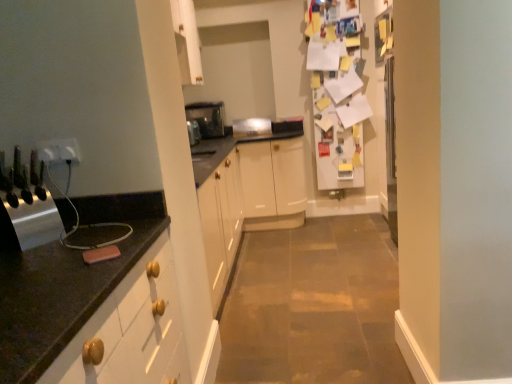
The width and height of the screenshot is (512, 384). What do you see at coordinates (337, 94) in the screenshot?
I see `white paper covered fridge at upper right` at bounding box center [337, 94].

Describe the element at coordinates (207, 118) in the screenshot. This screenshot has height=384, width=512. I see `satin silver toaster at center, which is counted as the fourth appliance, starting from the bottom` at that location.

You are a GUI agent. You are given a task and a screenshot of the screen. Output one action in this format:
    pyautogui.click(x=<x>, y=<y>)
    Task: Click on the satin silver toaster at center, which appears as the 3th appliance when viewed from the top
    This screenshot has height=384, width=512.
    Given the screenshot: What is the action you would take?
    pyautogui.click(x=193, y=132)

Measure the distance between point (40, 158) and camera.

A distance of 1.48 meters exists between point (40, 158) and camera.

What are the coordinates of `metallic knife block at left, marked as the 4th appliance in a back-to-front arrangement` in the screenshot? It's located at (28, 202).

Where is `white plastic outlet at left, which is the first electric outlet in right-to-left order`? Image resolution: width=512 pixels, height=384 pixels. white plastic outlet at left, which is the first electric outlet in right-to-left order is located at coordinates (59, 150).

Is white plastic electric outlet at left, which is counted as the 2th electric outlet, starting from the right, inside or outside of satin silver toaster at center, which appears as the first appliance when viewed from the back?

white plastic electric outlet at left, which is counted as the 2th electric outlet, starting from the right, is located beyond the bounds of satin silver toaster at center, which appears as the first appliance when viewed from the back.

Which object is positioned more to the left, white plastic electric outlet at left, which is the 1th electric outlet in left-to-right order, or satin silver toaster at center, marked as the 1th appliance in a top-to-bottom arrangement?

white plastic electric outlet at left, which is the 1th electric outlet in left-to-right order, is more to the left.

Is white plastic electric outlet at left, which is counted as the 2th electric outlet, starting from the right, thinner than satin silver toaster at center, which appears as the first appliance when viewed from the back?

Yes, white plastic electric outlet at left, which is counted as the 2th electric outlet, starting from the right, is thinner than satin silver toaster at center, which appears as the first appliance when viewed from the back.

Are white plastic electric outlet at left, which is counted as the 2th electric outlet, starting from the right, and satin silver toaster at center, which is counted as the fourth appliance, starting from the bottom, making contact?

There is a gap between white plastic electric outlet at left, which is counted as the 2th electric outlet, starting from the right, and satin silver toaster at center, which is counted as the fourth appliance, starting from the bottom.

Is satin silver toaster at center, acting as the second appliance starting from the top, thinner than white plastic outlet at left, which is the first electric outlet in right-to-left order?

In fact, satin silver toaster at center, acting as the second appliance starting from the top, might be wider than white plastic outlet at left, which is the first electric outlet in right-to-left order.

From the image's perspective, is satin silver toaster at center, acting as the third appliance starting from the front, above or below white plastic outlet at left, the second electric outlet from the left?

From the image's perspective, satin silver toaster at center, acting as the third appliance starting from the front, appears above white plastic outlet at left, the second electric outlet from the left.

Which is more distant, (x=244, y=130) or (x=70, y=149)?

The point (x=244, y=130) is farther.

Is satin silver toaster at center, which is the third appliance in bottom-to-top order, oriented away from white plastic outlet at left, which is the first electric outlet in right-to-left order?

satin silver toaster at center, which is the third appliance in bottom-to-top order, does not have its back to white plastic outlet at left, which is the first electric outlet in right-to-left order.

What's the angular difference between metallic knife block at left, marked as the 4th appliance in a back-to-front arrangement, and satin silver toaster at center, marked as the 1th appliance in a top-to-bottom arrangement,'s facing directions?

metallic knife block at left, marked as the 4th appliance in a back-to-front arrangement, and satin silver toaster at center, marked as the 1th appliance in a top-to-bottom arrangement, are facing 59.9 degrees away from each other.

Can you confirm if metallic knife block at left, marked as the 4th appliance in a back-to-front arrangement, is shorter than satin silver toaster at center, which is the 4th appliance from front to back?

Yes.

From the picture: From a real-world perspective, relative to satin silver toaster at center, which is counted as the fourth appliance, starting from the bottom, is metallic knife block at left, positioned as the 1th appliance in front-to-back order, vertically above or below?

metallic knife block at left, positioned as the 1th appliance in front-to-back order, is below satin silver toaster at center, which is counted as the fourth appliance, starting from the bottom.

Do you think metallic knife block at left, acting as the 4th appliance starting from the top, is within satin silver toaster at center, which appears as the first appliance when viewed from the back, or outside of it?

metallic knife block at left, acting as the 4th appliance starting from the top, is spatially situated outside satin silver toaster at center, which appears as the first appliance when viewed from the back.

Measure the distance between satin silver toaster at center, the third appliance from the back, and white paper covered fridge at upper right.

satin silver toaster at center, the third appliance from the back, is 4.68 feet from white paper covered fridge at upper right.

Is satin silver toaster at center, which appears as the 3th appliance when viewed from the top, in contact with white paper covered fridge at upper right?

No, satin silver toaster at center, which appears as the 3th appliance when viewed from the top, is not with white paper covered fridge at upper right.

Considering the positions of objects satin silver toaster at center, the second appliance in the bottom-to-top sequence, and white paper covered fridge at upper right in the image provided, who is more to the right, satin silver toaster at center, the second appliance in the bottom-to-top sequence, or white paper covered fridge at upper right?

white paper covered fridge at upper right is more to the right.

From a real-world perspective, relative to white paper covered fridge at upper right, is satin silver toaster at center, which appears as the 3th appliance when viewed from the top, vertically above or below?

Clearly, from a real-world perspective, satin silver toaster at center, which appears as the 3th appliance when viewed from the top, is below white paper covered fridge at upper right.

Are white plastic outlet at left, the second electric outlet from the left, and metallic knife block at left, acting as the 4th appliance starting from the top, beside each other?

No, white plastic outlet at left, the second electric outlet from the left, is not with metallic knife block at left, acting as the 4th appliance starting from the top.

Which object is more forward, white plastic outlet at left, which is the first electric outlet in right-to-left order, or metallic knife block at left, positioned as the 1th appliance in front-to-back order?

metallic knife block at left, positioned as the 1th appliance in front-to-back order, is more forward.

Is white plastic outlet at left, the second electric outlet from the left, facing towards metallic knife block at left, marked as the 4th appliance in a back-to-front arrangement?

Yes, white plastic outlet at left, the second electric outlet from the left, is facing metallic knife block at left, marked as the 4th appliance in a back-to-front arrangement.

Based on the photo, from the image's perspective, is white plastic outlet at left, which is the first electric outlet in right-to-left order, positioned above or below metallic knife block at left, positioned as the 1th appliance in front-to-back order?

From the image's perspective, white plastic outlet at left, which is the first electric outlet in right-to-left order, appears above metallic knife block at left, positioned as the 1th appliance in front-to-back order.

Considering the relative sizes of satin silver toaster at center, which is the third appliance in bottom-to-top order, and white paper covered fridge at upper right in the image provided, is satin silver toaster at center, which is the third appliance in bottom-to-top order, smaller than white paper covered fridge at upper right?

Indeed, satin silver toaster at center, which is the third appliance in bottom-to-top order, has a smaller size compared to white paper covered fridge at upper right.

In the scene shown: Is satin silver toaster at center, which is the third appliance in bottom-to-top order, located outside white paper covered fridge at upper right?

That's correct, satin silver toaster at center, which is the third appliance in bottom-to-top order, is outside of white paper covered fridge at upper right.

Between satin silver toaster at center, acting as the second appliance starting from the top, and white paper covered fridge at upper right, which one appears on the left side from the viewer's perspective?

satin silver toaster at center, acting as the second appliance starting from the top, is more to the left.

Is white plastic outlet at left, the second electric outlet from the left, at the back of satin silver toaster at center, which appears as the first appliance when viewed from the back?

No.

Is satin silver toaster at center, marked as the 1th appliance in a top-to-bottom arrangement, taller or shorter than white plastic outlet at left, which is the first electric outlet in right-to-left order?

Clearly, satin silver toaster at center, marked as the 1th appliance in a top-to-bottom arrangement, is taller compared to white plastic outlet at left, which is the first electric outlet in right-to-left order.

Is satin silver toaster at center, which appears as the first appliance when viewed from the back, not close to white plastic outlet at left, which is the first electric outlet in right-to-left order?

Absolutely, satin silver toaster at center, which appears as the first appliance when viewed from the back, is distant from white plastic outlet at left, which is the first electric outlet in right-to-left order.

You are a GUI agent. You are given a task and a screenshot of the screen. Output one action in this format:
    pyautogui.click(x=<x>, y=<y>)
    Task: Click on the 2nd appliance to the right of the white plastic outlet at left, which is the first electric outlet in right-to-left order, counting from the anchor's position
    The width and height of the screenshot is (512, 384).
    Given the screenshot: What is the action you would take?
    (x=207, y=118)

From the white plastic electric outlet at left, which is counted as the 2th electric outlet, starting from the right, count 3rd appliance to the right and point to it. Please provide its 2D coordinates.

[(207, 118)]

You are a GUI agent. You are given a task and a screenshot of the screen. Output one action in this format:
    pyautogui.click(x=<x>, y=<y>)
    Task: Click on the 4th appliance below the white plastic outlet at left, which is the first electric outlet in right-to-left order (from a real-world perspective)
    The width and height of the screenshot is (512, 384).
    Given the screenshot: What is the action you would take?
    pyautogui.click(x=251, y=127)

When comparing their distances from white plastic electric outlet at left, which is the 1th electric outlet in left-to-right order, does satin silver toaster at center, which appears as the first appliance when viewed from the back, or white paper covered fridge at upper right seem further?

The object further to white plastic electric outlet at left, which is the 1th electric outlet in left-to-right order, is white paper covered fridge at upper right.

Which object lies nearer to the anchor point metallic knife block at left, acting as the 4th appliance starting from the top, satin silver toaster at center, marked as the 1th appliance in a top-to-bottom arrangement, or white plastic outlet at left, which is the first electric outlet in right-to-left order?

white plastic outlet at left, which is the first electric outlet in right-to-left order.

From the image, which object appears to be farther from white plastic outlet at left, the second electric outlet from the left, satin silver toaster at center, the second appliance positioned from the back, or metallic knife block at left, marked as the 4th appliance in a back-to-front arrangement?

satin silver toaster at center, the second appliance positioned from the back, lies further to white plastic outlet at left, the second electric outlet from the left, than the other object.

Based on their spatial positions, is white paper covered fridge at upper right or white plastic outlet at left, which is the first electric outlet in right-to-left order, further from white plastic electric outlet at left, which is the 1th electric outlet in left-to-right order?

white paper covered fridge at upper right lies further to white plastic electric outlet at left, which is the 1th electric outlet in left-to-right order, than the other object.

Based on their spatial positions, is white paper covered fridge at upper right or white plastic outlet at left, the second electric outlet from the left, further from satin silver toaster at center, the second appliance positioned from the back?

white plastic outlet at left, the second electric outlet from the left, is positioned further to the anchor satin silver toaster at center, the second appliance positioned from the back.

Based on their spatial positions, is white plastic electric outlet at left, which is counted as the 2th electric outlet, starting from the right, or satin silver toaster at center, acting as the second appliance starting from the top, closer to white plastic outlet at left, the second electric outlet from the left?

white plastic electric outlet at left, which is counted as the 2th electric outlet, starting from the right, is positioned closer to the anchor white plastic outlet at left, the second electric outlet from the left.

Based on their spatial positions, is white paper covered fridge at upper right or white plastic outlet at left, which is the first electric outlet in right-to-left order, closer to satin silver toaster at center, which appears as the 3th appliance when viewed from the top?

Among the two, white paper covered fridge at upper right is located nearer to satin silver toaster at center, which appears as the 3th appliance when viewed from the top.

Based on their spatial positions, is satin silver toaster at center, the third appliance from the back, or satin silver toaster at center, which is the third appliance in bottom-to-top order, closer to white plastic electric outlet at left, which is counted as the 2th electric outlet, starting from the right?

satin silver toaster at center, the third appliance from the back, is positioned closer to the anchor white plastic electric outlet at left, which is counted as the 2th electric outlet, starting from the right.

What are the coordinates of `electric outlet between white plastic electric outlet at left, which is counted as the 2th electric outlet, starting from the right, and satin silver toaster at center, the third appliance from the back, in the front-back direction` in the screenshot? It's located at (59, 150).

In order to click on appliance between metallic knife block at left, marked as the 4th appliance in a back-to-front arrangement, and satin silver toaster at center, which is the third appliance in bottom-to-top order, along the z-axis in this screenshot , I will do `click(193, 132)`.

At what (x,y) coordinates should I click in order to perform the action: click on fridge between metallic knife block at left, the first appliance in the bottom-to-top sequence, and satin silver toaster at center, which is the third appliance in bottom-to-top order, from front to back. Please return your answer as a coordinate pair (x, y). Looking at the image, I should click on [337, 94].

Locate an element on the screen. The width and height of the screenshot is (512, 384). appliance between white plastic outlet at left, the second electric outlet from the left, and satin silver toaster at center, acting as the third appliance starting from the front, from front to back is located at coordinates (193, 132).